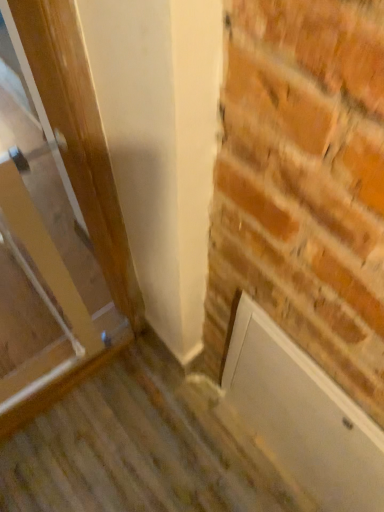
Question: In the image, is wooden door at left on the left side or the right side of white matte door at lower right?

Choices:
 (A) right
 (B) left

Answer: (B)

Question: Is wooden door at left inside the boundaries of white matte door at lower right, or outside?

Choices:
 (A) outside
 (B) inside

Answer: (A)

Question: In terms of width, does wooden door at left look wider or thinner when compared to white matte door at lower right?

Choices:
 (A) wide
 (B) thin

Answer: (A)

Question: Considering their positions, is white matte door at lower right located in front of or behind wooden door at left?

Choices:
 (A) behind
 (B) front

Answer: (A)

Question: Considering the positions of white matte door at lower right and wooden door at left in the image, is white matte door at lower right bigger or smaller than wooden door at left?

Choices:
 (A) big
 (B) small

Answer: (B)

Question: Is white matte door at lower right wider or thinner than wooden door at left?

Choices:
 (A) thin
 (B) wide

Answer: (A)

Question: From a real-world perspective, is white matte door at lower right physically located above or below wooden door at left?

Choices:
 (A) above
 (B) below

Answer: (B)